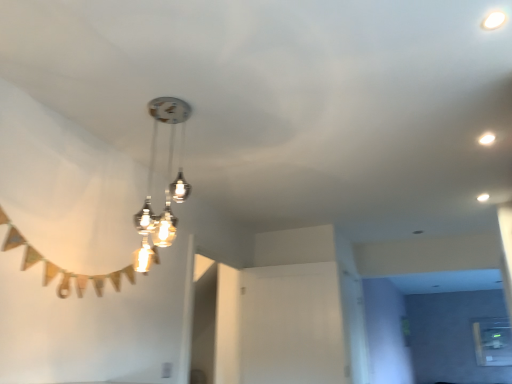
Question: Is transparent glass window at lower right positioned beyond the bounds of white glossy droplight at upper right?

Choices:
 (A) no
 (B) yes

Answer: (B)

Question: Can you confirm if transparent glass window at lower right is smaller than white glossy droplight at upper right?

Choices:
 (A) yes
 (B) no

Answer: (B)

Question: Is transparent glass window at lower right taller than white glossy droplight at upper right?

Choices:
 (A) no
 (B) yes

Answer: (B)

Question: Is transparent glass window at lower right turned away from white glossy droplight at upper right?

Choices:
 (A) no
 (B) yes

Answer: (A)

Question: From the image's perspective, is transparent glass window at lower right under white glossy droplight at upper right?

Choices:
 (A) no
 (B) yes

Answer: (B)

Question: Considering the relative positions of white glossy droplight at upper right and transparent glass window at lower right in the image provided, is white glossy droplight at upper right to the left or to the right of transparent glass window at lower right?

Choices:
 (A) left
 (B) right

Answer: (A)

Question: In terms of height, does white glossy droplight at upper right look taller or shorter compared to transparent glass window at lower right?

Choices:
 (A) tall
 (B) short

Answer: (B)

Question: From a real-world perspective, relative to transparent glass window at lower right, is white glossy droplight at upper right vertically above or below?

Choices:
 (A) below
 (B) above

Answer: (B)

Question: Which is correct: white glossy droplight at upper right is inside transparent glass window at lower right, or outside of it?

Choices:
 (A) inside
 (B) outside

Answer: (B)

Question: From a real-world perspective, is transparent glass window at lower right positioned above or below white glossy droplight at upper right?

Choices:
 (A) above
 (B) below

Answer: (B)

Question: Is point (509, 362) closer or farther from the camera than point (485, 23)?

Choices:
 (A) closer
 (B) farther

Answer: (B)

Question: In terms of height, does transparent glass window at lower right look taller or shorter compared to white glossy droplight at upper right?

Choices:
 (A) short
 (B) tall

Answer: (B)

Question: Is transparent glass window at lower right to the left or to the right of white glossy droplight at upper right in the image?

Choices:
 (A) right
 (B) left

Answer: (A)

Question: Based on their sizes in the image, would you say metallic glass chandelier at center is bigger or smaller than transparent glass window at lower right?

Choices:
 (A) big
 (B) small

Answer: (A)

Question: Based on their positions, is metallic glass chandelier at center located to the left or right of transparent glass window at lower right?

Choices:
 (A) left
 (B) right

Answer: (A)